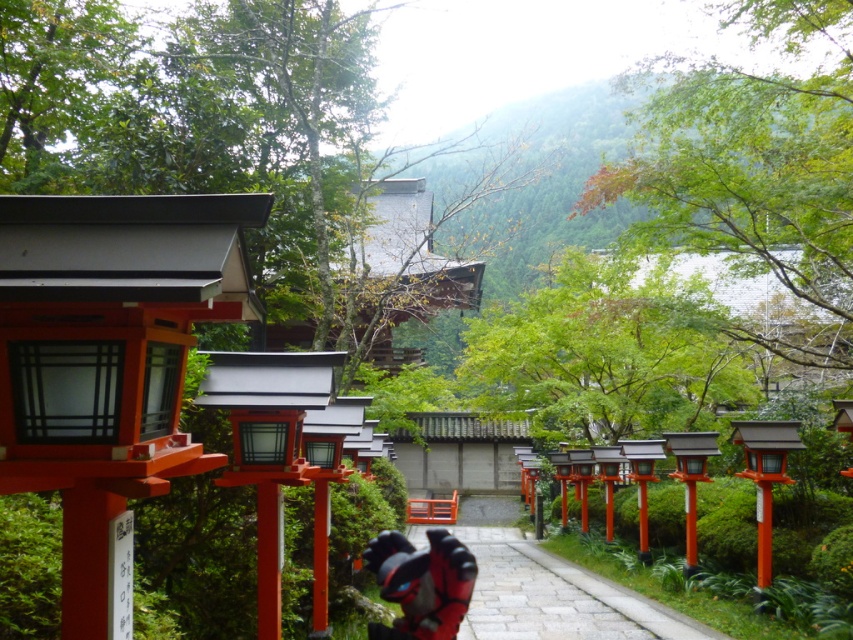
You are standing at the entrance of the temple pathway and see two points marked on the torii gates. The first point is at coordinates point (485, 608) and the second is at point (462, 577). Which point is closer to you?

Point (462, 577) is closer to you because it is less further to the camera than point (485, 608).

You are standing on the shiny red helmet at center and want to walk to the nearest red torii gate. Which direction should you face to walk along the smooth stone path at center towards the gate?

The smooth stone path at center is to the right of the shiny red helmet at center, so you should face towards the right direction to walk along the smooth stone path at center towards the nearest red torii gate.

You are a tourist visiting the temple and want to walk along the path while avoiding stepping on the shiny red helmet at center. Since the smooth stone path at center is wider than the helmet, can you walk safely around it?

The smooth stone path at center has a larger size compared to shiny red helmet at center, so yes, you can walk safely around the shiny red helmet at center as there is enough space on the path.